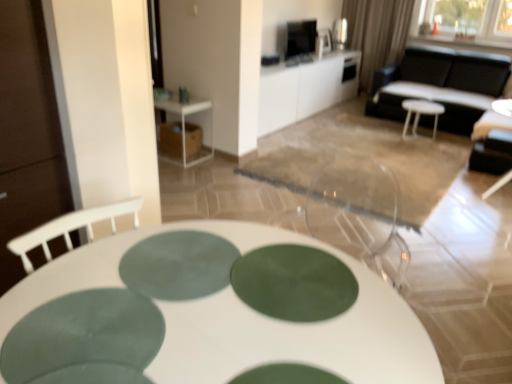
This screenshot has height=384, width=512. I want to click on spots to the right of green matte placemat at center, so click(x=288, y=281).